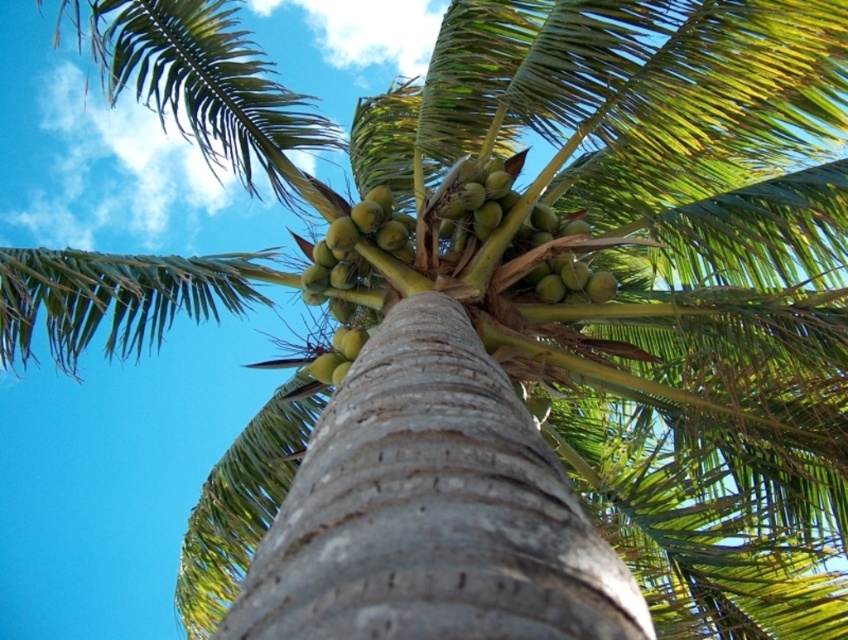
Who is lower down, green matte coconuts at upper center or green matte coconuts at center?

green matte coconuts at center

This screenshot has width=848, height=640. Find the location of `green matte coconuts at upper center`. green matte coconuts at upper center is located at coordinates (525, 250).

Is point (478, 205) behind point (349, 264)?

No, (478, 205) is closer to viewer.

Where is `green matte coconuts at upper center`? This screenshot has height=640, width=848. green matte coconuts at upper center is located at coordinates (525, 250).